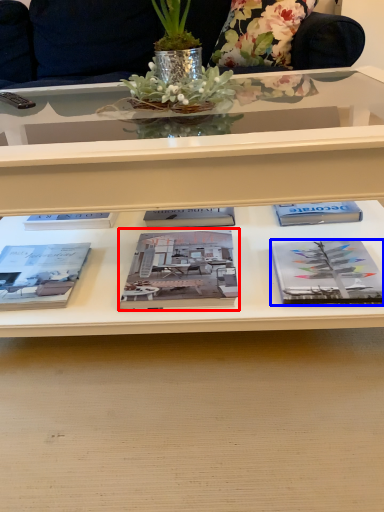
Question: Which of the following is the closest to the observer, book (highlighted by a red box) or book (highlighted by a blue box)?

Choices:
 (A) book
 (B) book

Answer: (B)